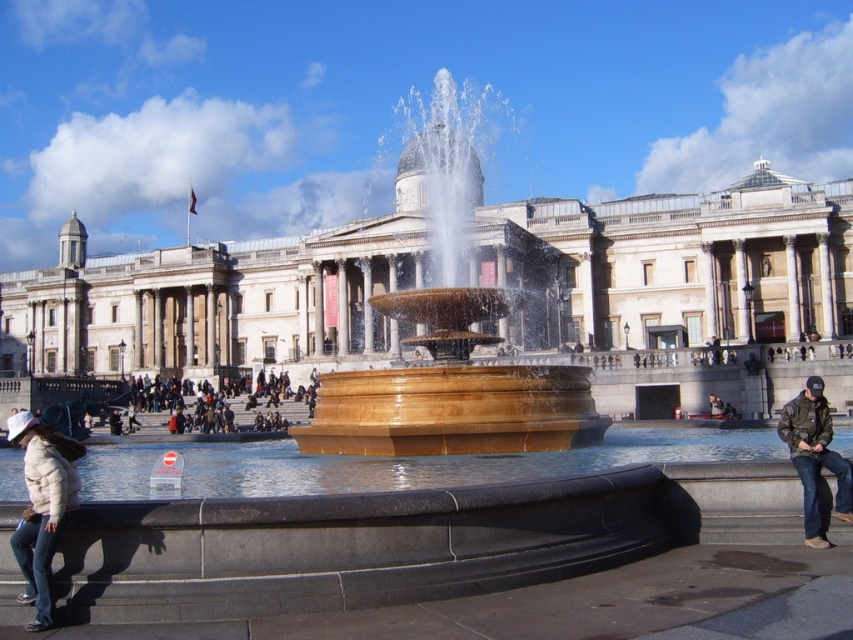
You are standing in the public square and want to take a photo of the golden stone fountain at center. Where should you position yourself to capture the fountain in the best possible view?

The golden stone fountain at center is located at point (450, 344), so positioning yourself directly in front of this coordinate will provide the optimal view for capturing the fountain.

You are a photographer standing in the public square and want to take a photo of both the white matte jacket at lower left and the camouflage jacket at lower right. Which jacket should you focus on first to ensure both are in the frame?

The white matte jacket at lower left is taller than the camouflage jacket at lower right, so you should focus on the white matte jacket at lower left first to ensure both are in the frame.

You are standing in the public square and see two jackets near the fountain. The white matte jacket at lower left and the camouflage jacket at lower right. Which jacket is closer to the ground?

The white matte jacket at lower left is closer to the ground since it is positioned below the camouflage jacket at lower right.